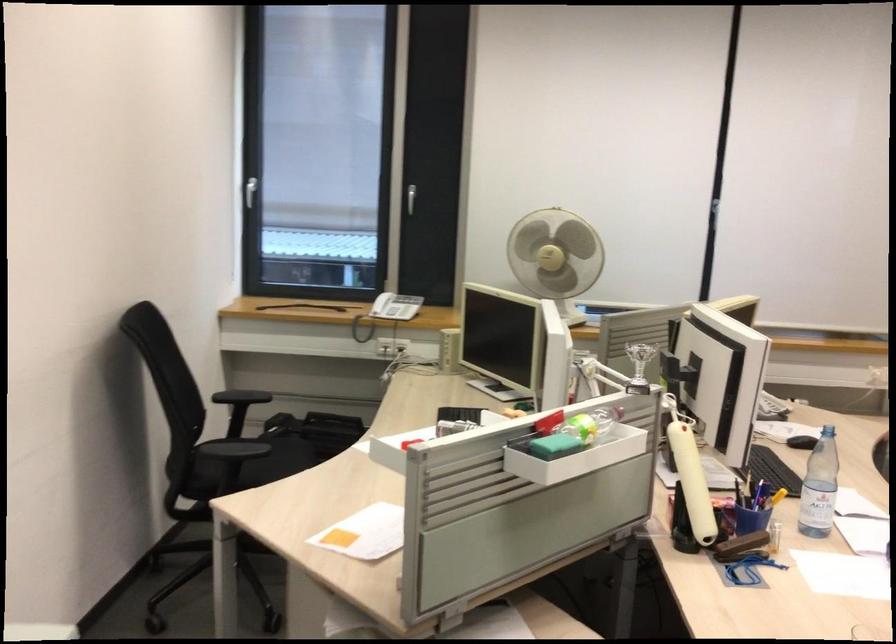
The image size is (896, 644). Find the location of `black chair armrest`. black chair armrest is located at coordinates (240, 395).